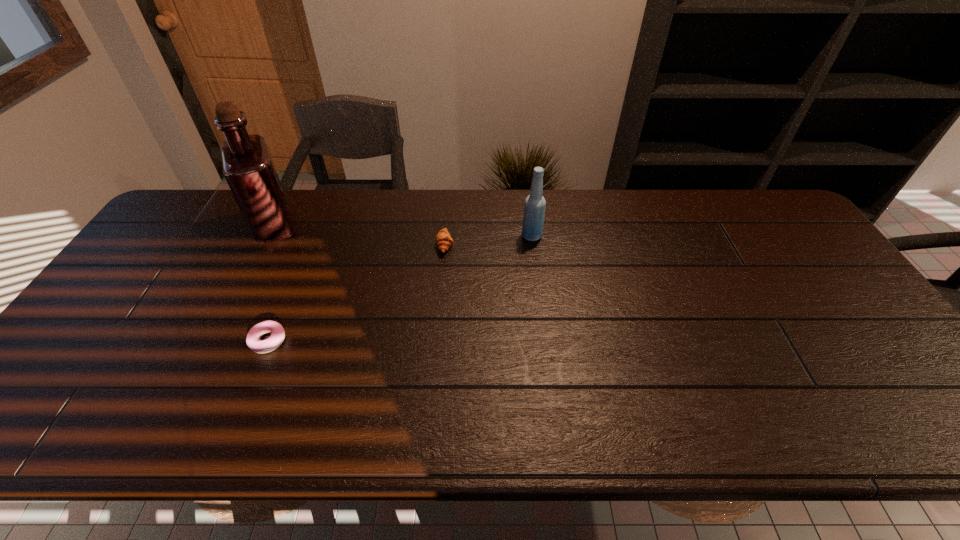
Identify the location of free spot that satisfies the following two spatial constraints: 1. on the front side of the nearer pastry; 2. on the right side of the tallest object. The image size is (960, 540). (216, 341).

Locate an element on the screen. The width and height of the screenshot is (960, 540). free space that satisfies the following two spatial constraints: 1. on the front side of the tallest object; 2. on the right side of the left pastry is located at coordinates (216, 341).

Locate an element on the screen. The width and height of the screenshot is (960, 540). blank area in the image that satisfies the following two spatial constraints: 1. on the front side of the liquor; 2. on the right side of the left pastry is located at coordinates (216, 341).

This screenshot has height=540, width=960. I want to click on free spot that satisfies the following two spatial constraints: 1. on the front side of the tallest object; 2. on the left side of the rightmost object, so click(x=270, y=236).